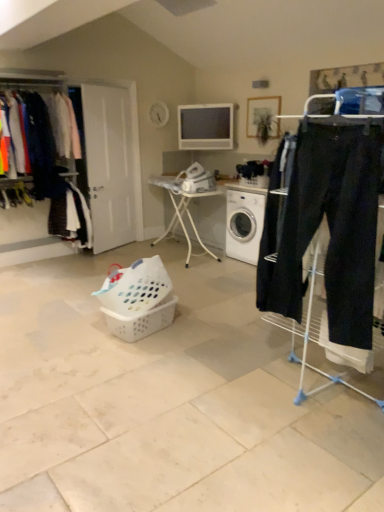
Image resolution: width=384 pixels, height=512 pixels. What are the coordinates of `vacant area that is in front of white plastic basket at center, acting as the first basket starting from the bottom` in the screenshot? It's located at (148, 355).